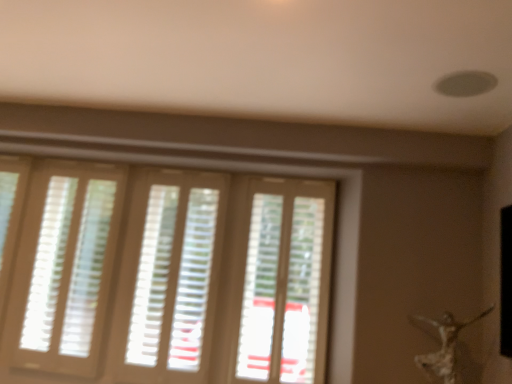
Question: Can you confirm if silver metallic statue at lower right is wider than white matte blinds at center, which is counted as the second blind, starting from the left?

Choices:
 (A) yes
 (B) no

Answer: (A)

Question: From a real-world perspective, is silver metallic statue at lower right physically below white matte blinds at center, which ranks as the 1th blind in right-to-left order?

Choices:
 (A) yes
 (B) no

Answer: (A)

Question: Is silver metallic statue at lower right at the right side of white matte blinds at center, which ranks as the 1th blind in right-to-left order?

Choices:
 (A) yes
 (B) no

Answer: (A)

Question: From the image's perspective, is silver metallic statue at lower right below white matte blinds at center, which is counted as the second blind, starting from the left?

Choices:
 (A) yes
 (B) no

Answer: (A)

Question: Is silver metallic statue at lower right at the left side of white matte blinds at center, which is counted as the second blind, starting from the left?

Choices:
 (A) no
 (B) yes

Answer: (A)

Question: Can you confirm if silver metallic statue at lower right is bigger than white matte blinds at center, which is counted as the second blind, starting from the left?

Choices:
 (A) no
 (B) yes

Answer: (A)

Question: Is light beige wooden blinds at left, the second blind from the right, closer to the viewer compared to white matte blinds at center, which is counted as the second blind, starting from the left?

Choices:
 (A) yes
 (B) no

Answer: (B)

Question: Are light beige wooden blinds at left, marked as the first blind in a left-to-right arrangement, and white matte blinds at center, which ranks as the 1th blind in right-to-left order, located far from each other?

Choices:
 (A) yes
 (B) no

Answer: (B)

Question: Is white matte blinds at center, which is counted as the second blind, starting from the left, at the back of light beige wooden blinds at left, the second blind from the right?

Choices:
 (A) no
 (B) yes

Answer: (A)

Question: Considering the relative sizes of light beige wooden blinds at left, the second blind from the right, and white matte blinds at center, which ranks as the 1th blind in right-to-left order, in the image provided, is light beige wooden blinds at left, the second blind from the right, bigger than white matte blinds at center, which ranks as the 1th blind in right-to-left order,?

Choices:
 (A) no
 (B) yes

Answer: (A)

Question: Are light beige wooden blinds at left, the second blind from the right, and white matte blinds at center, which is counted as the second blind, starting from the left, beside each other?

Choices:
 (A) no
 (B) yes

Answer: (A)

Question: Is light beige wooden blinds at left, marked as the first blind in a left-to-right arrangement, outside white matte blinds at center, which ranks as the 1th blind in right-to-left order?

Choices:
 (A) no
 (B) yes

Answer: (B)

Question: From the image's perspective, would you say silver metallic statue at lower right is shown under translucent plastic screen door at center?

Choices:
 (A) yes
 (B) no

Answer: (A)